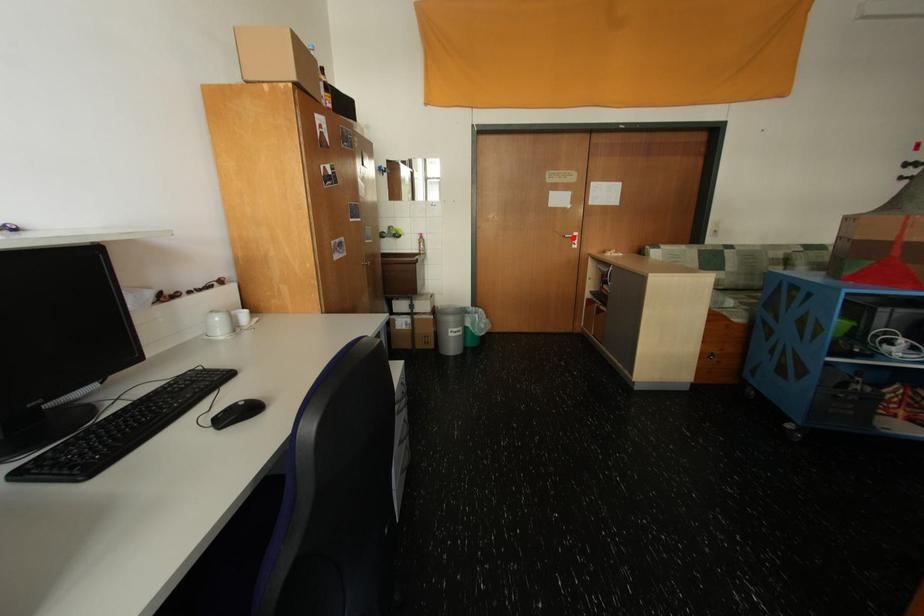
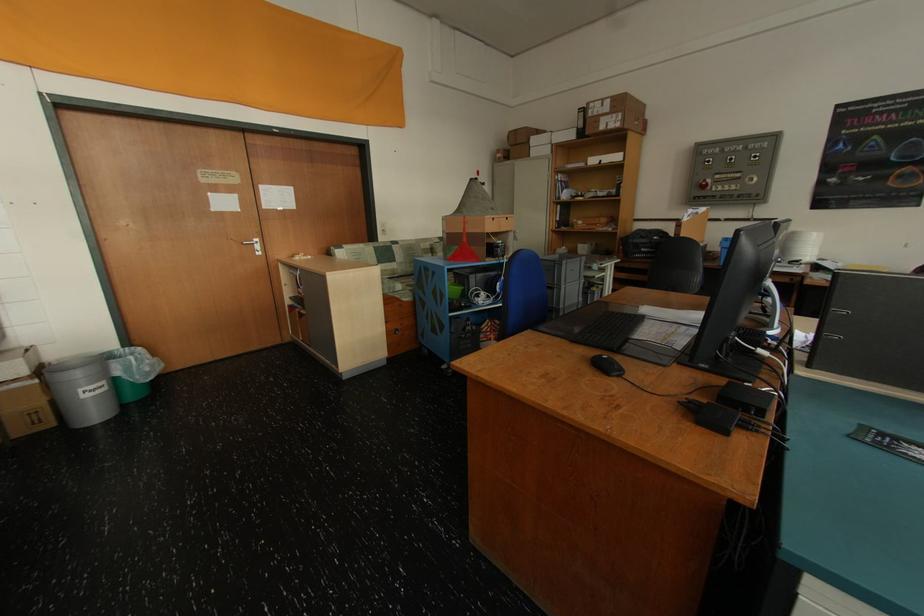
Locate, in the second image, the point that corresponds to the highlighted location in the first image.

(251, 245)